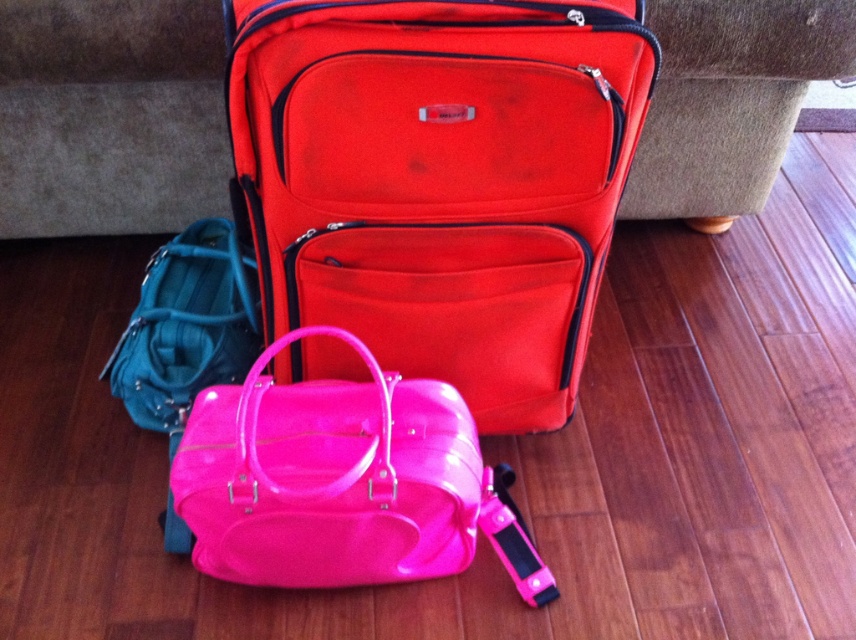
Can you confirm if suede-like brown couch at upper center is positioned below glossy teal handbag at lower left?

No, suede-like brown couch at upper center is not below glossy teal handbag at lower left.

What do you see at coordinates (110, 115) in the screenshot? I see `suede-like brown couch at upper center` at bounding box center [110, 115].

This screenshot has width=856, height=640. What are the coordinates of `suede-like brown couch at upper center` in the screenshot? It's located at (110, 115).

Who is shorter, matte red suitcase at center or glossy vinyl duffel at center?

Standing shorter between the two is glossy vinyl duffel at center.

Between matte red suitcase at center and glossy vinyl duffel at center, which one appears on the right side from the viewer's perspective?

From the viewer's perspective, matte red suitcase at center appears more on the right side.

Describe the element at coordinates (440, 179) in the screenshot. I see `matte red suitcase at center` at that location.

You are a GUI agent. You are given a task and a screenshot of the screen. Output one action in this format:
    pyautogui.click(x=<x>, y=<y>)
    Task: Click on the matte red suitcase at center
    
    Given the screenshot: What is the action you would take?
    pyautogui.click(x=440, y=179)

The width and height of the screenshot is (856, 640). I want to click on matte red suitcase at center, so pos(440,179).